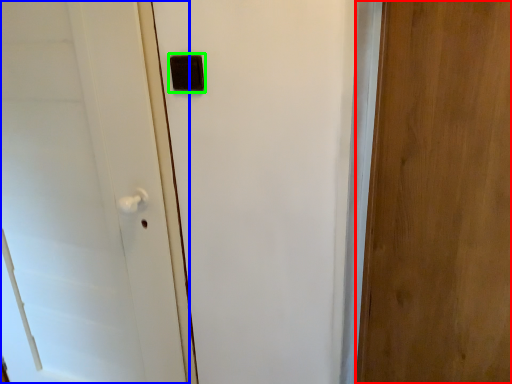
Question: Which object is the farthest from door (highlighted by a red box)? Choose among these: door (highlighted by a blue box) or light switch (highlighted by a green box).

Choices:
 (A) door
 (B) light switch

Answer: (A)